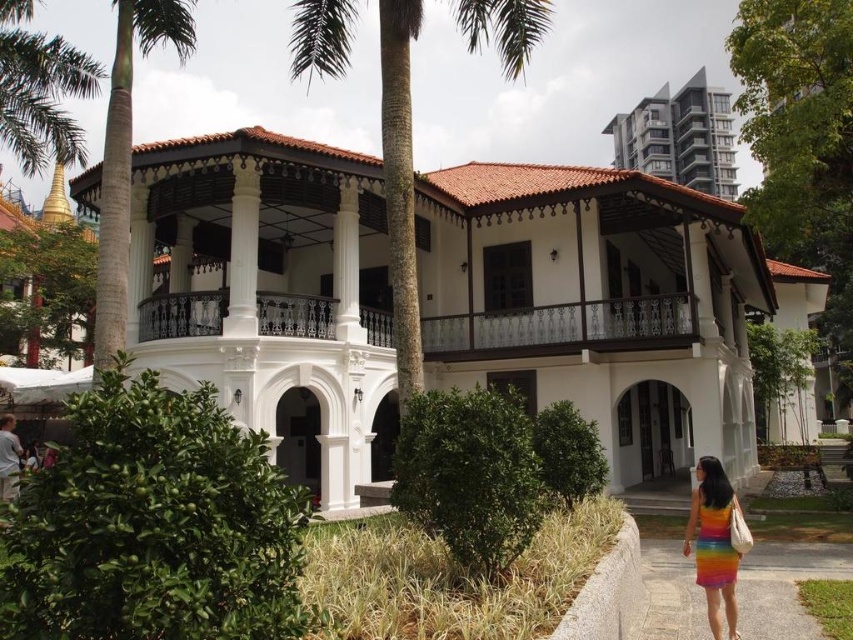
Question: Which of these objects is positioned farthest from the green leafy palm tree at upper left?

Choices:
 (A) white painted wood palace at center
 (B) green leafy palm tree at center
 (C) gravel path at lower right

Answer: (C)

Question: Where is green leafy palm tree at left located in relation to matte gray building at upper right in the image?

Choices:
 (A) left
 (B) right

Answer: (A)

Question: Does white painted wood palace at center lie behind green leafy palm tree at center?

Choices:
 (A) yes
 (B) no

Answer: (A)

Question: Which point is closer to the camera taking this photo?

Choices:
 (A) (715, 465)
 (B) (787, 572)
 (C) (666, 122)

Answer: (A)

Question: Can you confirm if green leafy palm tree at left is thinner than rainbow fabric dress at lower right?

Choices:
 (A) no
 (B) yes

Answer: (A)

Question: Which point is farther to the camera?

Choices:
 (A) white painted wood palace at center
 (B) green leafy palm tree at center
 (C) green leafy palm tree at upper left
 (D) gravel path at lower right

Answer: (C)